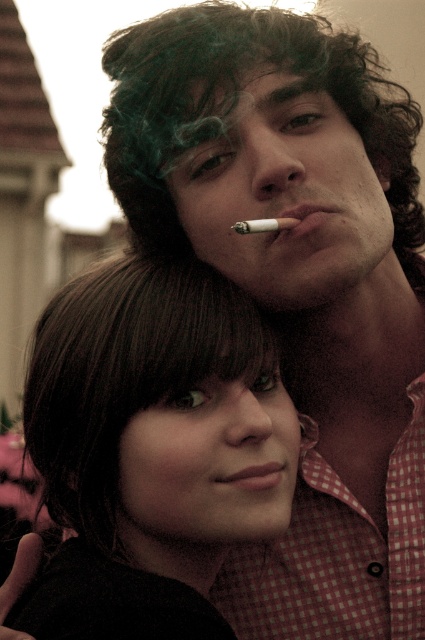
Between point (187, 484) and point (235, 225), which one is positioned in front?

Point (187, 484) is more forward.

The width and height of the screenshot is (425, 640). Identify the location of smooth dark hair at center. (150, 448).

You are a GUI agent. You are given a task and a screenshot of the screen. Output one action in this format:
    pyautogui.click(x=<x>, y=<y>)
    Task: Click on the smooth dark hair at center
    The image size is (425, 640).
    Given the screenshot: What is the action you would take?
    pyautogui.click(x=150, y=448)

The height and width of the screenshot is (640, 425). I want to click on smooth dark hair at center, so click(150, 448).

Can you confirm if smooth dark hair at center is thinner than matte pink lips at center?

Incorrect, smooth dark hair at center's width is not less than matte pink lips at center's.

In the scene shown: Is smooth dark hair at center closer to camera compared to matte pink lips at center?

Yes, smooth dark hair at center is in front of matte pink lips at center.

Does point (127, 305) come in front of point (221, 481)?

No.

Locate an element on the screen. smooth dark hair at center is located at coordinates (150, 448).

Locate an element on the screen. Image resolution: width=425 pixels, height=640 pixels. green curly wig at upper center is located at coordinates (232, 104).

Who is positioned more to the right, green curly wig at upper center or matte cigarette at center?

From the viewer's perspective, matte cigarette at center appears more on the right side.

From the picture: Measure the distance between green curly wig at upper center and camera.

green curly wig at upper center and camera are 46.70 meters apart.

Find the location of a particular element. This screenshot has height=640, width=425. green curly wig at upper center is located at coordinates (232, 104).